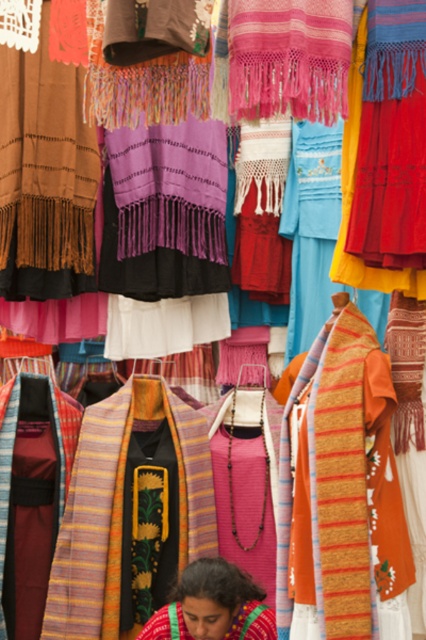
Question: Can you confirm if embroidered fabric at lower center is positioned below textured orange shawl at center?

Choices:
 (A) yes
 (B) no

Answer: (B)

Question: Where is embroidered fabric at lower center located in relation to textured orange shawl at center in the image?

Choices:
 (A) below
 (B) above

Answer: (B)

Question: Is embroidered fabric at lower center wider than textured orange shawl at center?

Choices:
 (A) no
 (B) yes

Answer: (A)